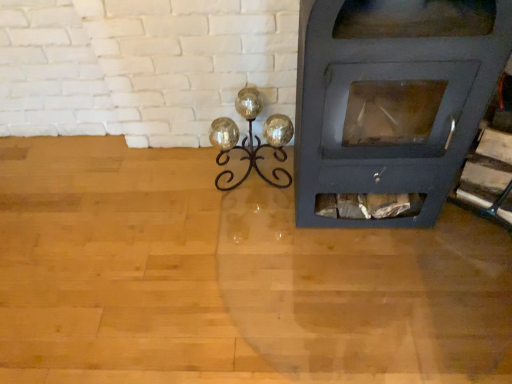
Describe the element at coordinates (251, 138) in the screenshot. I see `silver reflective spheres at center` at that location.

At what (x,y) coordinates should I click in order to perform the action: click on silver reflective spheres at center. Please return your answer as a coordinate pair (x, y). This screenshot has width=512, height=384. Looking at the image, I should click on (251, 138).

What is the approximate height of silver reflective spheres at center?

silver reflective spheres at center is 13.42 inches tall.

Locate an element on the screen. The height and width of the screenshot is (384, 512). silver reflective spheres at center is located at coordinates (251, 138).